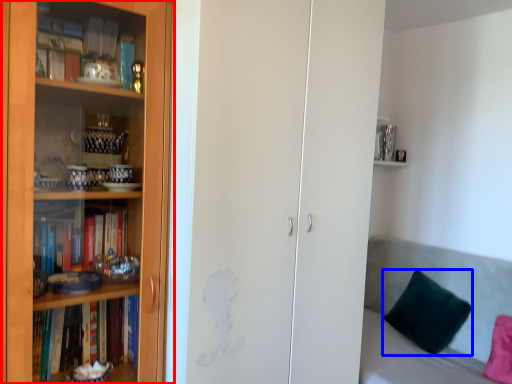
Question: Which object appears farthest to the camera in this image, bookcase (highlighted by a red box) or pillow (highlighted by a blue box)?

Choices:
 (A) bookcase
 (B) pillow

Answer: (B)